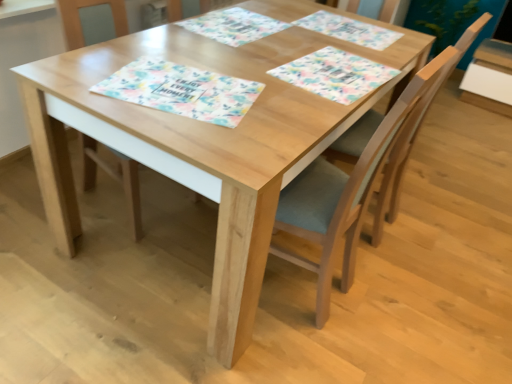
Where is `vacant area in front of floral paper placemat at center, the first place mat viewed from the front`? vacant area in front of floral paper placemat at center, the first place mat viewed from the front is located at coordinates (197, 140).